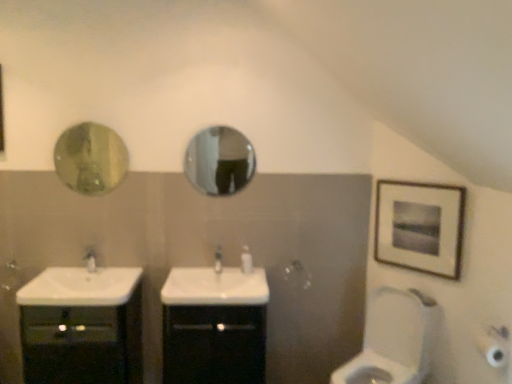
Question: Should I look upward or downward to see black glossy cabinet at lower left, the 1th bathroom cabinet from the left?

Choices:
 (A) up
 (B) down

Answer: (B)

Question: Considering the relative sizes of green glass mirror at upper left, which ranks as the 2th mirror in right-to-left order, and white glossy toilet at lower right in the image provided, is green glass mirror at upper left, which ranks as the 2th mirror in right-to-left order, shorter than white glossy toilet at lower right?

Choices:
 (A) yes
 (B) no

Answer: (A)

Question: Is green glass mirror at upper left, which ranks as the 2th mirror in right-to-left order, thinner than white glossy toilet at lower right?

Choices:
 (A) yes
 (B) no

Answer: (A)

Question: From the image's perspective, is green glass mirror at upper left, which ranks as the 2th mirror in right-to-left order, over white glossy toilet at lower right?

Choices:
 (A) no
 (B) yes

Answer: (B)

Question: From a real-world perspective, is green glass mirror at upper left, the first mirror in the left-to-right sequence, under white glossy toilet at lower right?

Choices:
 (A) yes
 (B) no

Answer: (B)

Question: Considering the relative sizes of green glass mirror at upper left, which ranks as the 2th mirror in right-to-left order, and white glossy toilet at lower right in the image provided, is green glass mirror at upper left, which ranks as the 2th mirror in right-to-left order, wider than white glossy toilet at lower right?

Choices:
 (A) no
 (B) yes

Answer: (A)

Question: Does green glass mirror at upper left, the first mirror in the left-to-right sequence, contain white glossy toilet at lower right?

Choices:
 (A) no
 (B) yes

Answer: (A)

Question: From the image's perspective, is white glossy sink at center, positioned as the first sink in right-to-left order, located above green glass mirror at upper left, which ranks as the 2th mirror in right-to-left order?

Choices:
 (A) yes
 (B) no

Answer: (B)

Question: Considering the relative sizes of white glossy sink at center, positioned as the first sink in right-to-left order, and green glass mirror at upper left, which ranks as the 2th mirror in right-to-left order, in the image provided, is white glossy sink at center, positioned as the first sink in right-to-left order, taller than green glass mirror at upper left, which ranks as the 2th mirror in right-to-left order,?

Choices:
 (A) yes
 (B) no

Answer: (B)

Question: Can you confirm if white glossy sink at center, the 2th sink positioned from the left, is smaller than green glass mirror at upper left, the first mirror in the left-to-right sequence?

Choices:
 (A) no
 (B) yes

Answer: (A)

Question: Can you confirm if white glossy sink at center, the 2th sink positioned from the left, is positioned to the left of green glass mirror at upper left, the first mirror in the left-to-right sequence?

Choices:
 (A) yes
 (B) no

Answer: (B)

Question: Would you consider white glossy sink at center, positioned as the first sink in right-to-left order, to be distant from green glass mirror at upper left, which ranks as the 2th mirror in right-to-left order?

Choices:
 (A) yes
 (B) no

Answer: (B)

Question: Is white glossy sink at center, the 2th sink positioned from the left, positioned with its back to green glass mirror at upper left, the first mirror in the left-to-right sequence?

Choices:
 (A) yes
 (B) no

Answer: (B)

Question: Does glossy metallic mirror at center, which is counted as the first mirror, starting from the right, appear on the right side of white glossy tap at center, the second tap viewed from the right?

Choices:
 (A) no
 (B) yes

Answer: (B)